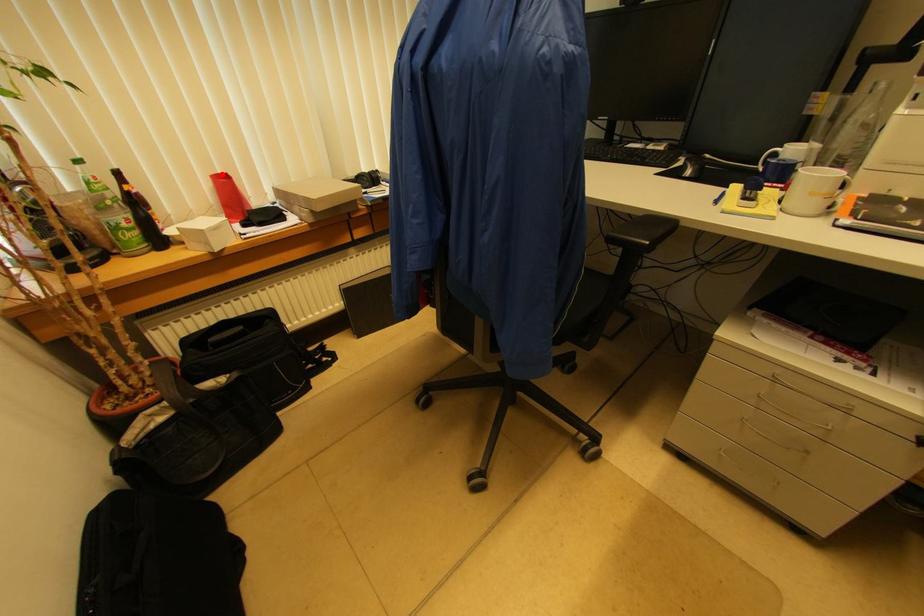
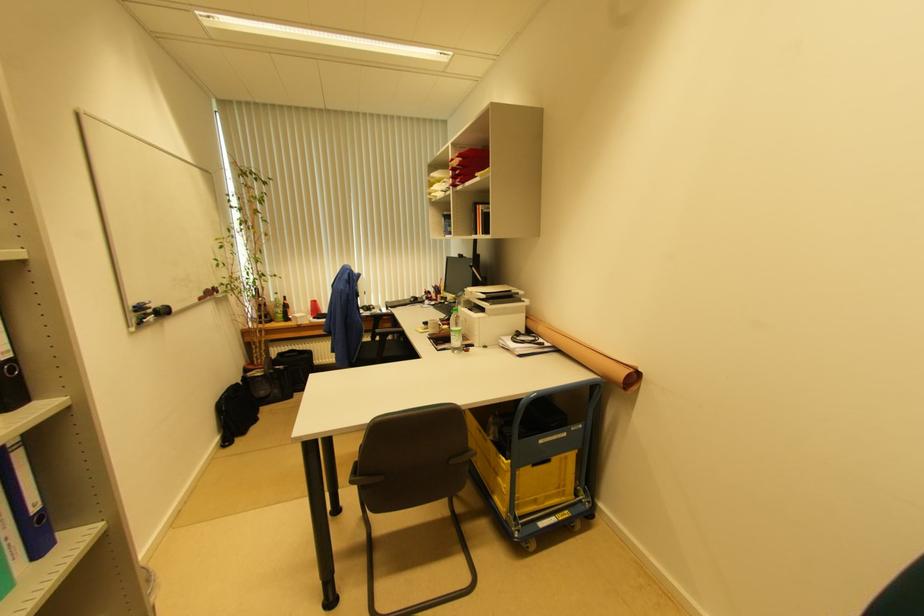
In the second image, find the point that corresponds to the highlighted location in the first image.

(315, 302)